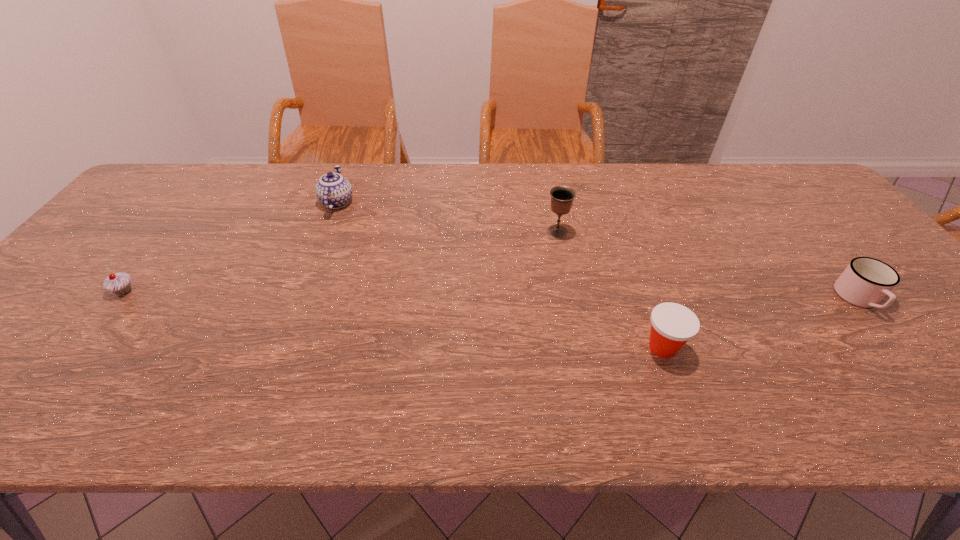
The width and height of the screenshot is (960, 540). In order to click on vacant space at the right edge of the desktop in this screenshot , I will do `click(943, 357)`.

Identify the location of vacant region at the far left corner of the desktop. (158, 197).

I want to click on vacant space that is in between the farthest object and the third object from left to right, so point(447,217).

Identify the location of vacant space that is in between the Dixie cup and the mug. The width and height of the screenshot is (960, 540). (760, 323).

Where is `vacant point located between the cupcake and the second farthest object`? The height and width of the screenshot is (540, 960). vacant point located between the cupcake and the second farthest object is located at coordinates (341, 261).

You are a GUI agent. You are given a task and a screenshot of the screen. Output one action in this format:
    pyautogui.click(x=<x>, y=<y>)
    Task: Click on the vacant area that lies between the cupcake and the second object from right to left
    
    Given the screenshot: What is the action you would take?
    pyautogui.click(x=394, y=320)

What are the coordinates of `vacant area between the chinaware and the rightmost object` in the screenshot? It's located at (598, 251).

Image resolution: width=960 pixels, height=540 pixels. I want to click on unoccupied area between the leftmost object and the farthest object, so click(x=230, y=247).

Locate an element on the screen. The image size is (960, 540). vacant area that lies between the leftmost object and the chalice is located at coordinates (341, 261).

I want to click on free point between the leftmost object and the farthest object, so click(x=230, y=247).